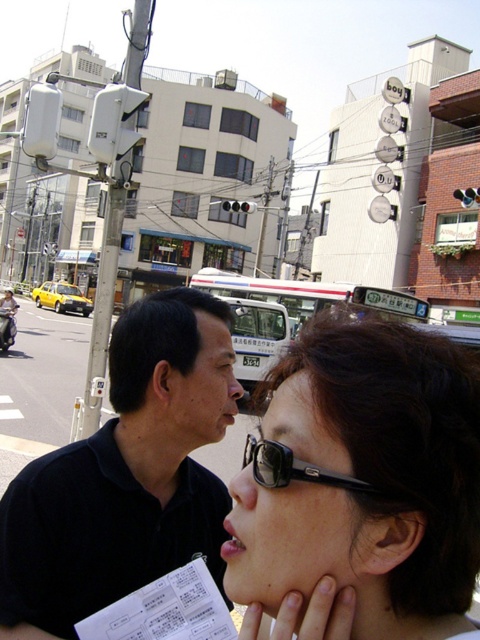
Is black matte sunglasses at center shorter than black plastic sunglasses at upper center?

Incorrect, black matte sunglasses at center's height does not fall short of black plastic sunglasses at upper center's.

Does black matte sunglasses at center have a smaller size compared to black plastic sunglasses at upper center?

Actually, black matte sunglasses at center might be larger than black plastic sunglasses at upper center.

Is point (335, 314) closer to camera compared to point (300, 467)?

No, it is behind (300, 467).

You are a GUI agent. You are given a task and a screenshot of the screen. Output one action in this format:
    pyautogui.click(x=<x>, y=<y>)
    Task: Click on the black matte sunglasses at center
    
    Given the screenshot: What is the action you would take?
    pyautogui.click(x=363, y=477)

Does black matte shirt at center have a smaller size compared to black plastic sunglasses at upper center?

Actually, black matte shirt at center might be larger than black plastic sunglasses at upper center.

Consider the image. Between black matte shirt at center and black plastic sunglasses at upper center, which one has more height?

black matte shirt at center is taller.

Is point (156, 308) closer to viewer compared to point (287, 460)?

No, it is behind (287, 460).

This screenshot has width=480, height=640. Identify the location of black matte shirt at center. (126, 474).

Is point (348, 394) positioned in front of point (96, 545)?

Yes, point (348, 394) is closer to viewer.

Does black matte sunglasses at center come in front of black matte shirt at center?

Yes, it is.

Locate an element on the screen. black matte sunglasses at center is located at coordinates coord(363,477).